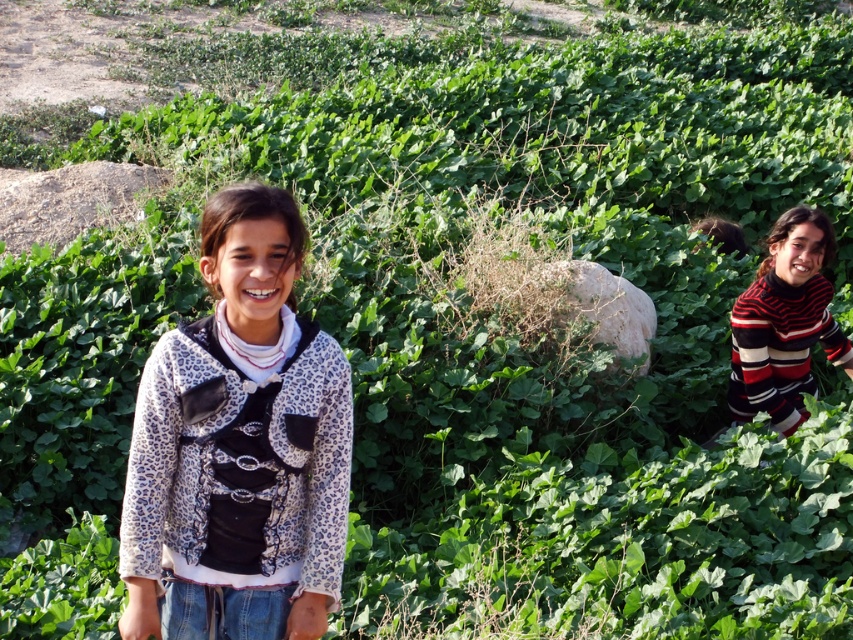
You are a photographer trying to capture the leopard print fabric sweater at center and the striped sweater at right in the same frame. Which sweater should you focus on first to ensure both are in the shot?

The leopard print fabric sweater at center is below the striped sweater at right, so you should focus on the striped sweater at right first to ensure both are in the shot.

You are planning to take a photo of both the leopard print fabric sweater at center and the striped sweater at right. The camera you have can only focus on objects within a 3.5 meter range. Will you be able to capture both sweaters in focus at the same time?

The distance between the leopard print fabric sweater at center and the striped sweater at right is 4.23 meters, which exceeds the camera focus range of 3.5 meters. Therefore, you cannot capture both sweaters in focus simultaneously.

You are a photographer trying to capture both the leopard print fabric sweater at center and the striped sweater at right in the same frame. Based on their positions, which sweater should you adjust to ensure both are visible?

The leopard print fabric sweater at center is to the left of striped sweater at right. To ensure both are visible, you should move the striped sweater at right slightly to the right or the leopard print fabric sweater at center slightly to the left.